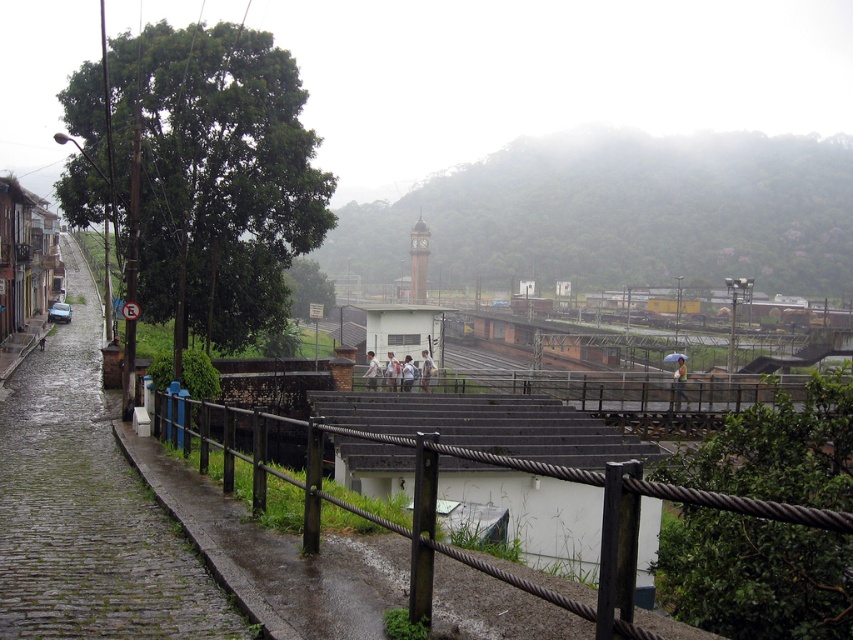
You are standing on the cobblestone street in the scene and want to place the light gray fabric shirt at center on top of the wooden at lower center. Will the shirt fit entirely on the wooden surface?

The wooden at lower center is larger in size than the light gray fabric shirt at center, so the shirt will fit entirely on the wooden surface.

From the picture: You are standing at the point marked as point (392, 371) in the image. What object is directly in front of you?

The white fabric at center is located at point (392, 371), so the object directly in front of you is the white fabric at center.

You are a photographer trying to capture a shot of the yellow fabric umbrella at center and the white cotton shirt at center in the misty scene. Since the camera has a limited focus range, you need to know which object is wider to ensure proper framing. Which one is wider?

The yellow fabric umbrella at center is wider than the white cotton shirt at center.